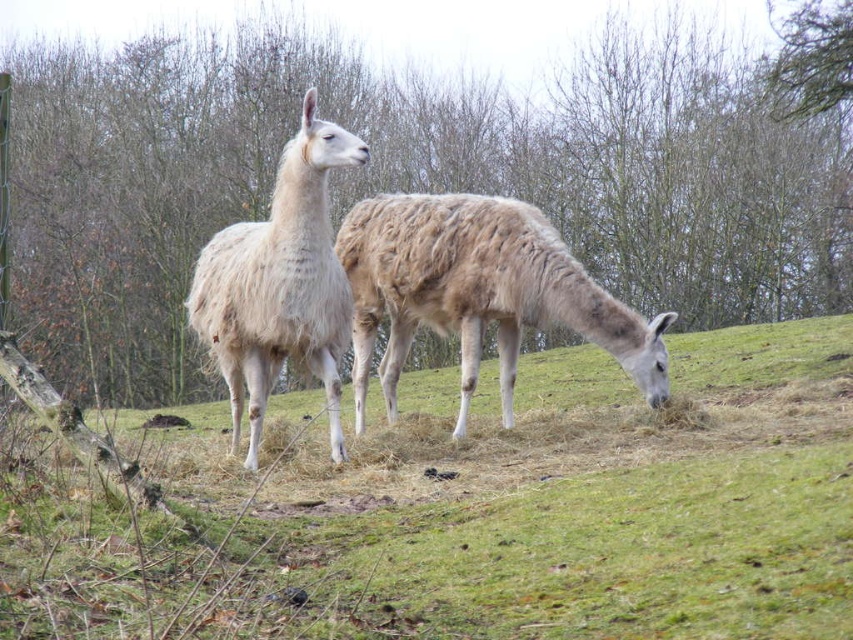
You are a hiker who wants to take a photo of the brown leafy tree at upper center and the fuzzy beige camel at center. Since you have a camera with a fixed focal length, you need to know which object is larger in the scene to frame your shot properly. Can you tell me which one is bigger?

The brown leafy tree at upper center is bigger than the fuzzy beige camel at center, so you should frame the shot to accommodate the larger tree.